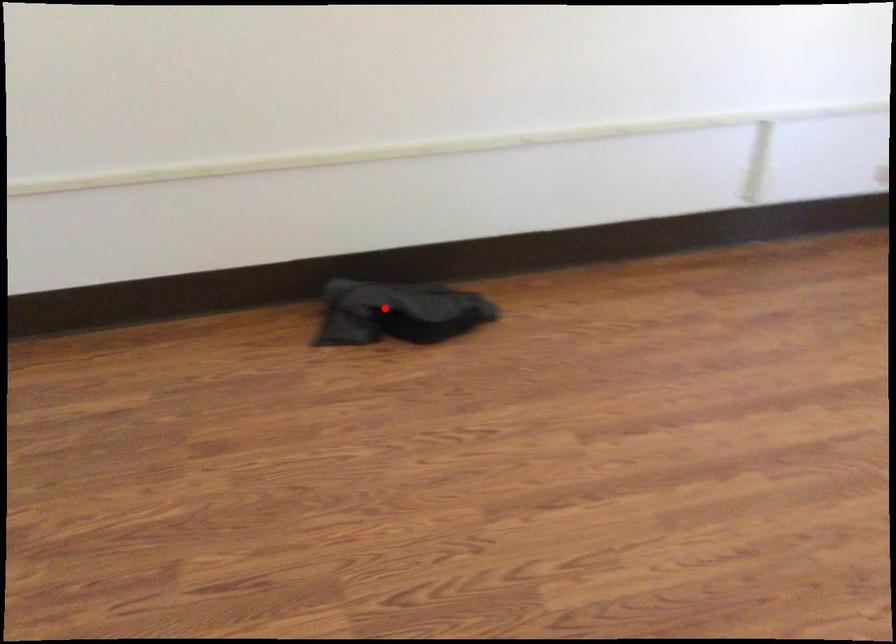
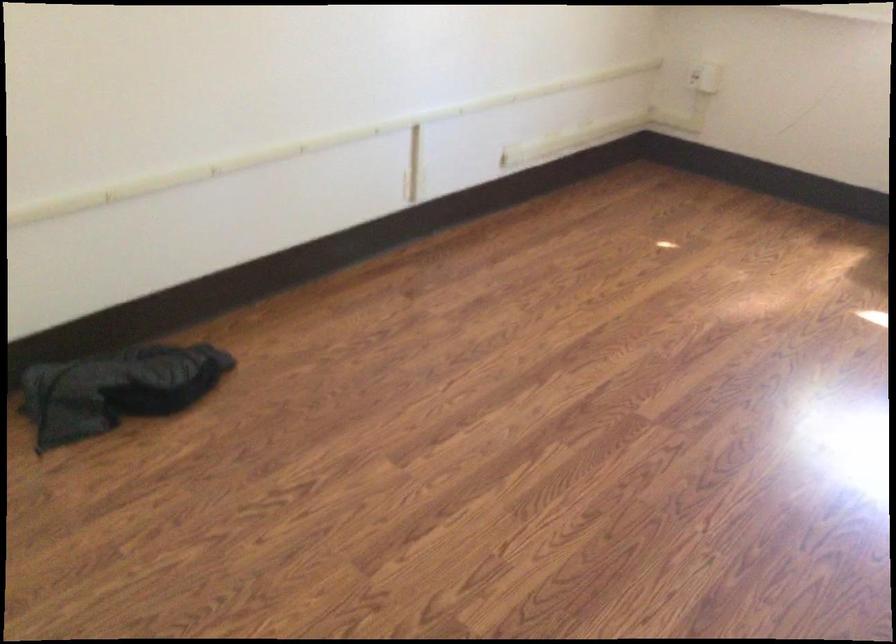
Question: A red point is marked in image1. In image2, is the corresponding 3D point closer to the camera or farther? Reply with the corresponding letter.

Choices:
 (A) The corresponding 3D point is closer.
 (B) The corresponding 3D point is farther.

Answer: (A)